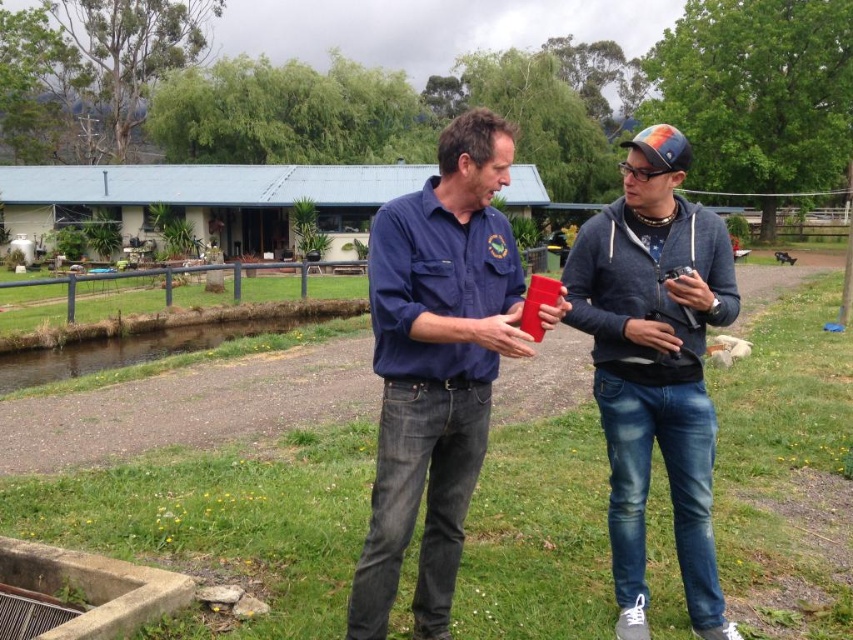
You are a fashion designer analyzing the outfit of the person on the left. Based on the image, where is the matte blue shirt at center positioned relative to the denim jeans at center?

The matte blue shirt at center is located below the denim jeans at center.

What is the color of the shirt worn by the person at the point coordinates (436, 365) in the image?

The color of the shirt at the point coordinates (436, 365) is matte blue.